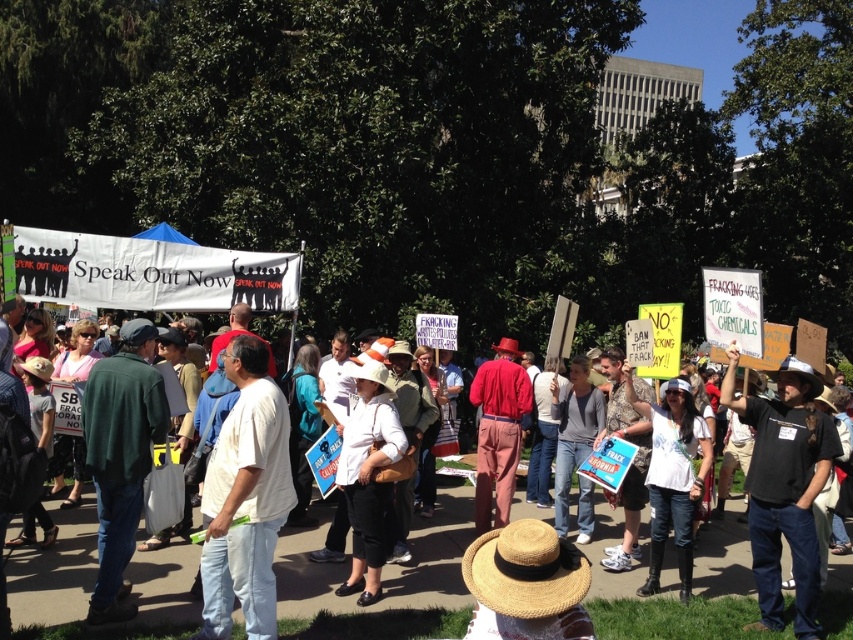
Question: Which object is closer to the camera taking this photo?

Choices:
 (A) black cotton shirt at center
 (B) white cotton shirt at center

Answer: (B)

Question: Does white cotton shirt at center appear over black cotton shirt at center?

Choices:
 (A) no
 (B) yes

Answer: (B)

Question: Can you confirm if white cotton shirt at center is smaller than black cotton shirt at center?

Choices:
 (A) yes
 (B) no

Answer: (A)

Question: Does white cotton shirt at center have a greater width compared to black cotton shirt at center?

Choices:
 (A) yes
 (B) no

Answer: (B)

Question: Which object appears closest to the camera in this image?

Choices:
 (A) white cotton shirt at center
 (B) black cotton shirt at center

Answer: (A)